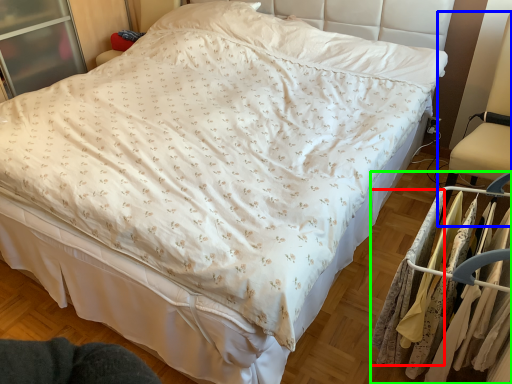
Question: Which object is positioned farthest from clothing (highlighted by a red box)? Select from swivel chair (highlighted by a blue box) and closet (highlighted by a green box).

Choices:
 (A) swivel chair
 (B) closet

Answer: (A)